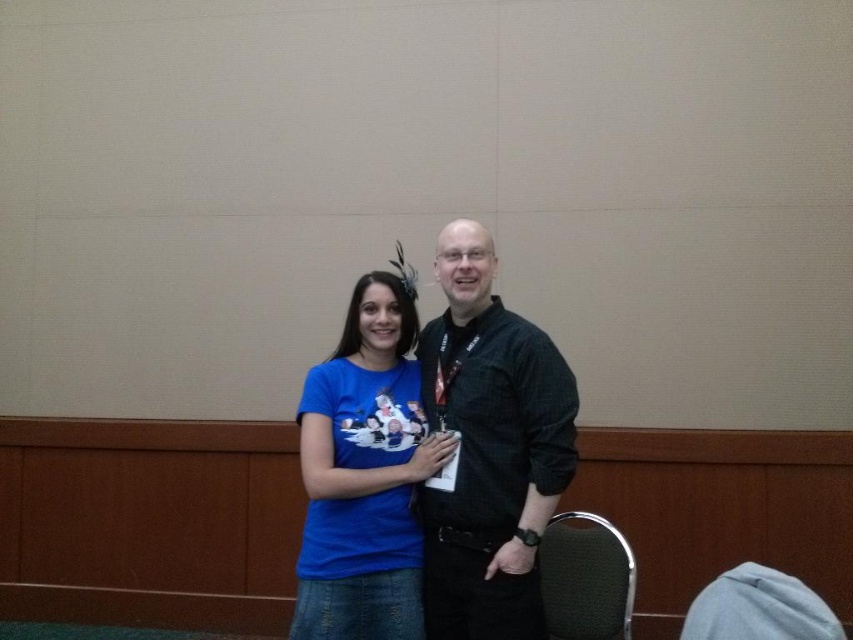
Does black textured shirt at center appear over blue cotton t-shirt at center?

Correct, black textured shirt at center is located above blue cotton t-shirt at center.

Does black textured shirt at center have a lesser height compared to blue cotton t-shirt at center?

No, black textured shirt at center is not shorter than blue cotton t-shirt at center.

This screenshot has width=853, height=640. I want to click on black textured shirt at center, so click(489, 449).

Measure the distance from blue cotton t-shirt at center to green fabric chair at lower right.

blue cotton t-shirt at center is 24.90 inches away from green fabric chair at lower right.

Does blue cotton t-shirt at center have a lesser height compared to green fabric chair at lower right?

No, blue cotton t-shirt at center is not shorter than green fabric chair at lower right.

Describe the element at coordinates (364, 474) in the screenshot. I see `blue cotton t-shirt at center` at that location.

Find the location of a particular element. The image size is (853, 640). blue cotton t-shirt at center is located at coordinates (364, 474).

Is black textured shirt at center thinner than green fabric chair at lower right?

No.

Which is in front, point (526, 337) or point (628, 582)?

Positioned in front is point (526, 337).

Who is more distant from viewer, (473, 499) or (572, 545)?

Positioned behind is point (572, 545).

You are a GUI agent. You are given a task and a screenshot of the screen. Output one action in this format:
    pyautogui.click(x=<x>, y=<y>)
    Task: Click on the black textured shirt at center
    
    Given the screenshot: What is the action you would take?
    pyautogui.click(x=489, y=449)